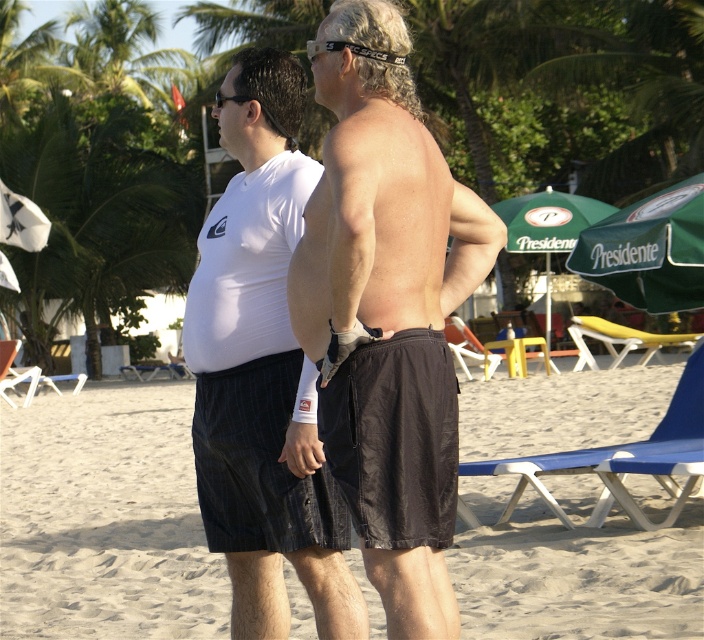
You are a photographer taking a picture of the two people at the beach. You want to ensure both points, point (565, 401) and point (365, 492), are in focus. Which point should you focus on first to ensure the other is also in focus?

You should focus on point (365, 492) first because it is closer to the camera than point (565, 401). By focusing on the closer point, the farther one will also be in focus due to the depth of field.

You are a photographer trying to capture the black fabric shorts at center in the beach scene. Based on their 2D coordinates, where should you position your camera to ensure the shorts are centered in the frame?

The black fabric shorts at center are located at point 0.811 on the x and 0.151 on the y coordinates, so position your camera so the center of the frame aligns with those coordinates to capture them directly in the middle.